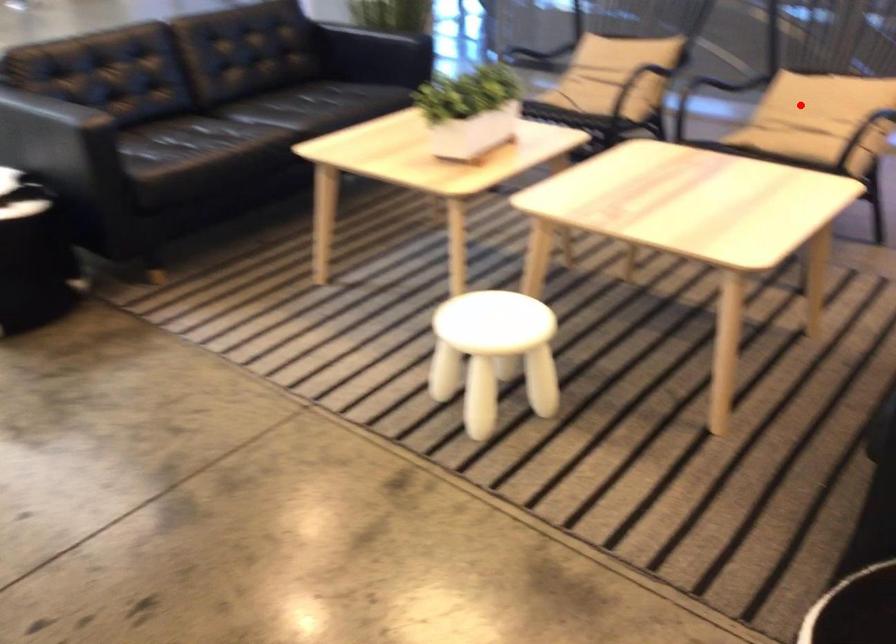
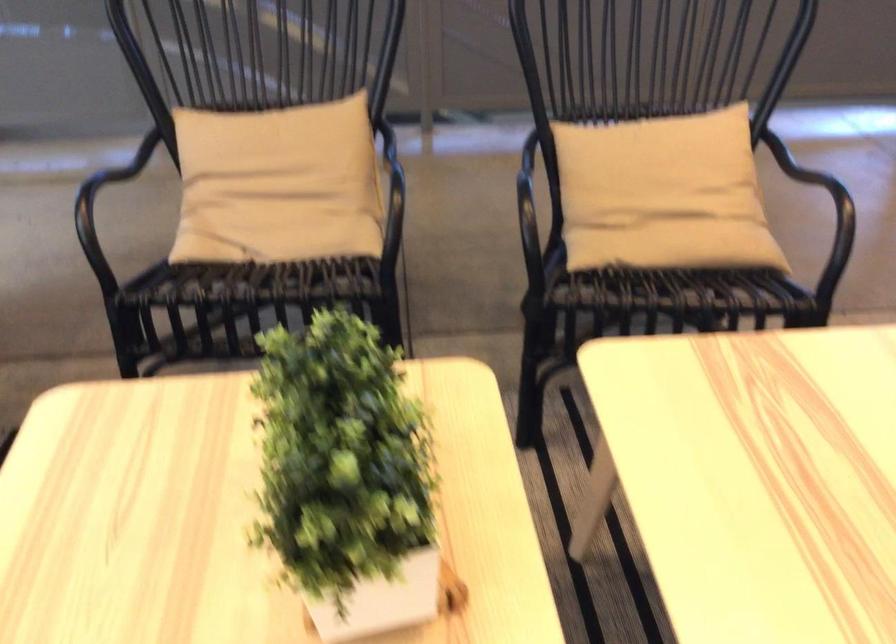
Locate, in the second image, the point that corresponds to the highlighted location in the first image.

(662, 194)